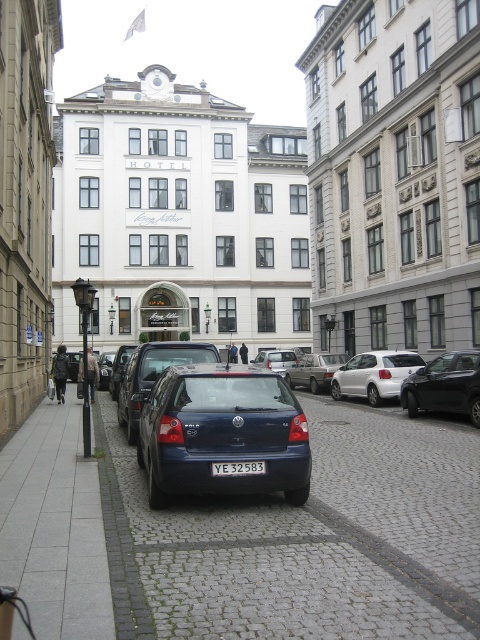
You are a tourist driving a matte blue hatchback at center and a white matte hatchback at center. You want to park your car on the right side of the street. Which car should you move to the right first?

The matte blue hatchback at center should be moved to the right first since it is positioned on the left side of the white matte hatchback at center, so moving it first allows both cars to adjust their positions without blocking each other.

You are standing at the corner of the street and want to take a photo of the blue matte car at center. Where should you position yourself to capture it in the frame?

To capture the blue matte car at center in the frame, position yourself at the corner of the street facing towards the center, as the car is located at coordinates point (154, 374).

In the scene shown: You are a delivery driver who needs to park your blue matte car at center in a parking spot that requires vehicles to be no taller than the yellow metallic license plate at center. Can your car fit in the parking spot?

The blue matte car at center is taller than the yellow metallic license plate at center, so it cannot fit in the parking spot that requires vehicles to be no taller than the license plate height.